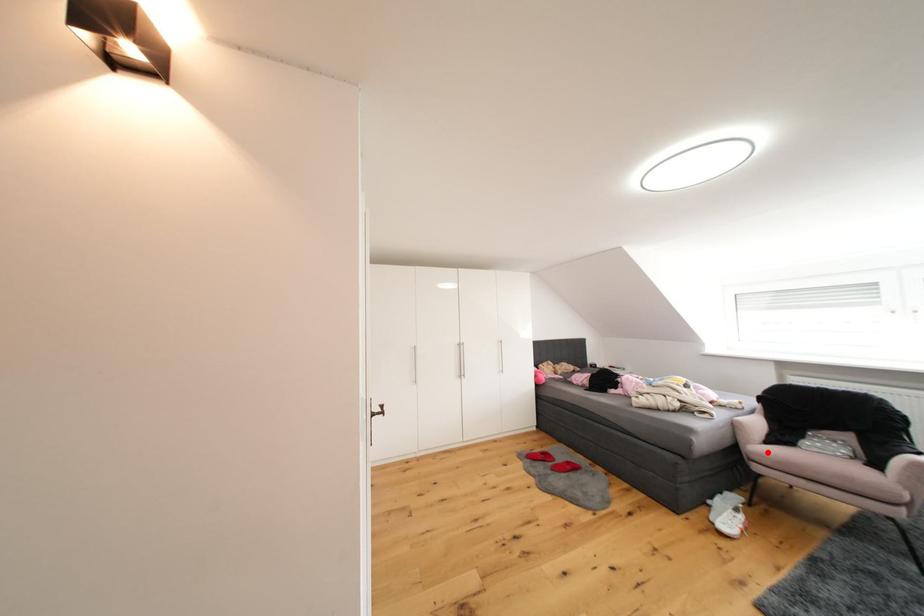
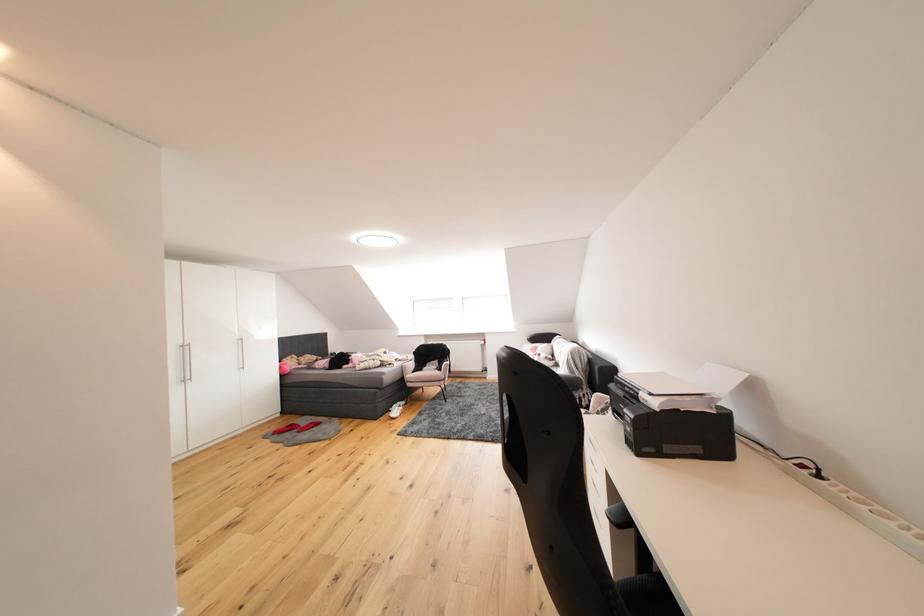
In the second image, find the point that corresponds to the highlighted location in the first image.

(419, 379)